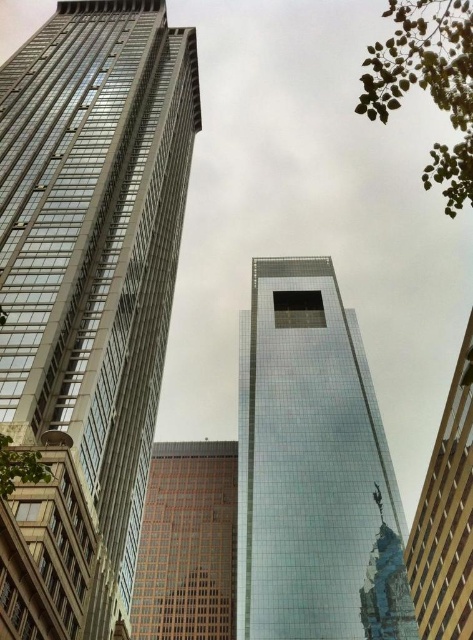
Is brown brick building at center above matte glass skyscraper at right?

Actually, brown brick building at center is below matte glass skyscraper at right.

Who is higher up, brown brick building at center or matte glass skyscraper at right?

Positioned higher is matte glass skyscraper at right.

Does point (165, 532) come behind point (472, 544)?

Yes, it is.

The height and width of the screenshot is (640, 473). I want to click on brown brick building at center, so (187, 544).

Does glassy steel skyscraper at center lie behind matte glass skyscraper at right?

No.

Does point (171, 96) come behind point (464, 600)?

Yes, point (171, 96) is behind point (464, 600).

Which is in front, point (134, 67) or point (456, 490)?

Positioned in front is point (456, 490).

You are a GUI agent. You are given a task and a screenshot of the screen. Output one action in this format:
    pyautogui.click(x=<x>, y=<y>)
    Task: Click on the glassy steel skyscraper at center
    The width and height of the screenshot is (473, 640).
    Given the screenshot: What is the action you would take?
    pyautogui.click(x=87, y=294)

Between glassy steel skyscraper at center and brown brick building at center, which one has more height?

glassy steel skyscraper at center is taller.

Does point (77, 621) come in front of point (158, 444)?

Yes, point (77, 621) is in front of point (158, 444).

Locate an element on the screen. This screenshot has width=473, height=640. glassy steel skyscraper at center is located at coordinates (87, 294).